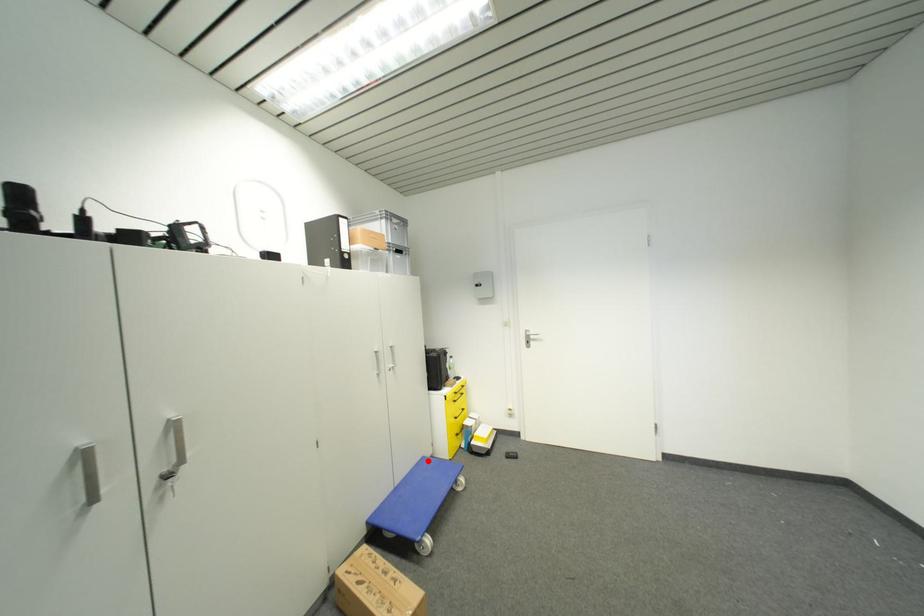
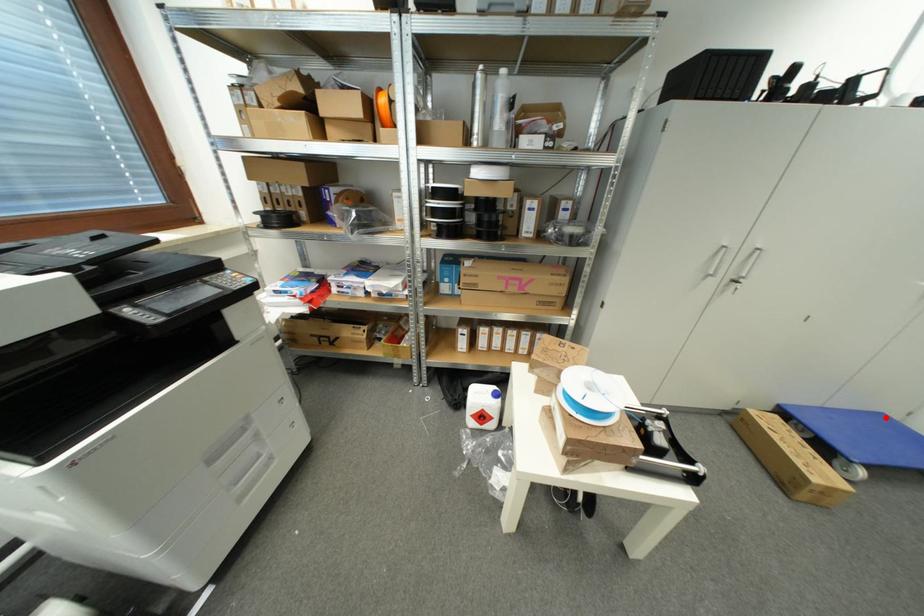
I am providing you with two images of the same scene from different viewpoints. A red point is marked on the first image and another point is marked on the second image. Does the point marked in image1 correspond to the same location as the one in image2?

Yes